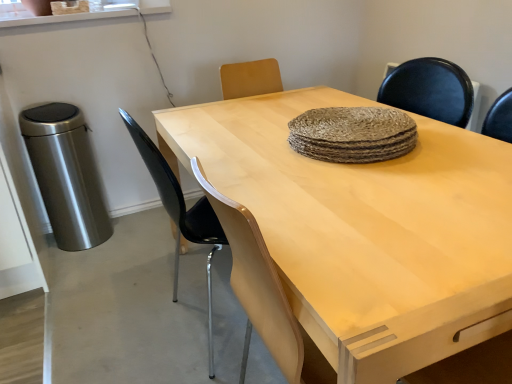
Question: In the image, is light wood table at center positioned in front of or behind black plastic chair at center?

Choices:
 (A) behind
 (B) front

Answer: (B)

Question: Based on their positions, is light wood table at center located to the left or right of black plastic chair at center?

Choices:
 (A) left
 (B) right

Answer: (B)

Question: Is light wood table at center situated inside black plastic chair at center or outside?

Choices:
 (A) inside
 (B) outside

Answer: (B)

Question: In the image, is black plastic chair at center on the left side or the right side of light wood table at center?

Choices:
 (A) right
 (B) left

Answer: (B)

Question: In terms of size, does black plastic chair at center appear bigger or smaller than light wood table at center?

Choices:
 (A) big
 (B) small

Answer: (B)

Question: From the image's perspective, relative to light wood table at center, is black plastic chair at center above or below?

Choices:
 (A) above
 (B) below

Answer: (A)

Question: In the image, is black plastic chair at center positioned in front of or behind light wood table at center?

Choices:
 (A) behind
 (B) front

Answer: (A)